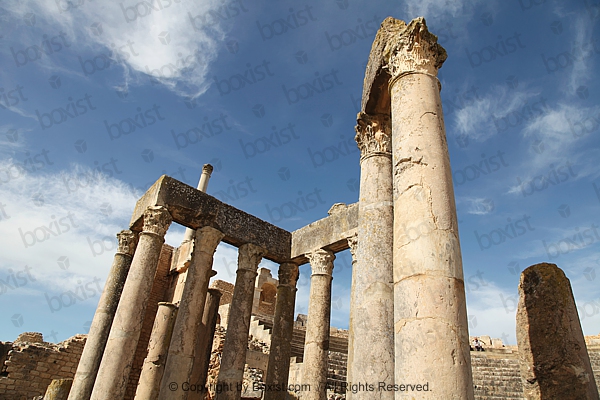
Identify the location of pillar. This screenshot has height=400, width=600. (545, 349).